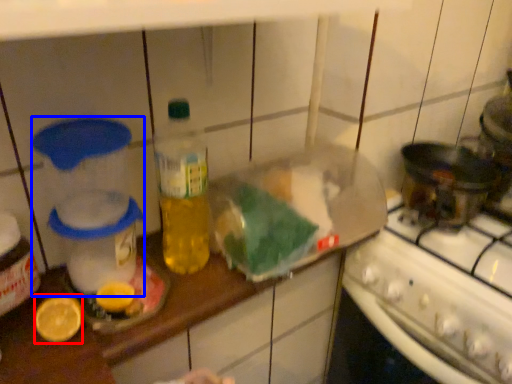
Question: Which point is further to the camera, lemon (highlighted by a red box) or appliance (highlighted by a blue box)?

Choices:
 (A) lemon
 (B) appliance

Answer: (A)